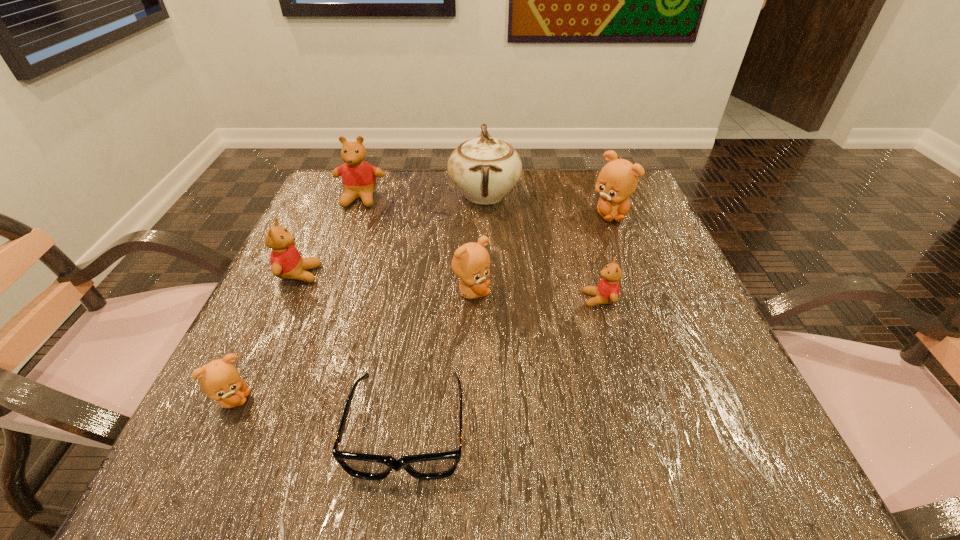
Locate an element on the screen. The image size is (960, 540). empty location between the nearest teddy bear and the shortest object is located at coordinates (321, 415).

The width and height of the screenshot is (960, 540). I want to click on free point between the black sunglasses and the biggest brown teddy bear, so click(x=509, y=322).

Choose which object is the seventh nearest neighbor to the biggest red teddy bear. Please provide its 2D coordinates. Your answer should be formatted as a tuple, i.e. [(x, y)], where the tuple contains the x and y coordinates of a point satisfying the conditions above.

[(607, 292)]

The image size is (960, 540). What are the coordinates of `object that is the second closest to the biggest red teddy bear` in the screenshot? It's located at (286, 262).

This screenshot has width=960, height=540. Find the location of `teddy bear that can be found as the closest to the biggest brown teddy bear`. teddy bear that can be found as the closest to the biggest brown teddy bear is located at coordinates (607, 292).

Locate which teddy bear ranks in proximity to the smallest brown teddy bear. Please provide its 2D coordinates. Your answer should be formatted as a tuple, i.e. [(x, y)], where the tuple contains the x and y coordinates of a point satisfying the conditions above.

[(286, 262)]

Locate an element on the screen. This screenshot has height=540, width=960. red teddy bear that stands as the second closest to the biggest red teddy bear is located at coordinates (607, 292).

At what (x,y) coordinates should I click in order to perform the action: click on the closest red teddy bear to the shortest object. Please return your answer as a coordinate pair (x, y). This screenshot has height=540, width=960. Looking at the image, I should click on (286, 262).

Locate which brown teddy bear ranks in proximity to the leftmost brown teddy bear. Please provide its 2D coordinates. Your answer should be formatted as a tuple, i.e. [(x, y)], where the tuple contains the x and y coordinates of a point satisfying the conditions above.

[(471, 262)]

This screenshot has width=960, height=540. In order to click on brown teddy bear that is the closest one to the second smallest red teddy bear in this screenshot , I will do `click(220, 380)`.